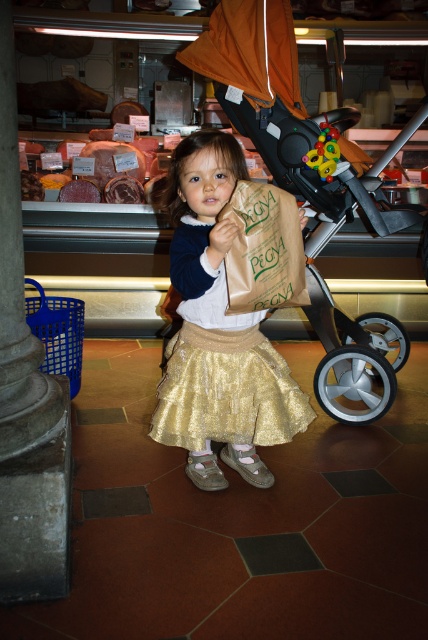
Based on the photo, who is lower down, gold shimmering skirt at center or brown paper bag at center?

Positioned lower is gold shimmering skirt at center.

Is gold shimmering skirt at center shorter than brown paper bag at center?

No.

Does point (175, 406) come closer to viewer compared to point (288, 262)?

No, it is behind (288, 262).

You are a GUI agent. You are given a task and a screenshot of the screen. Output one action in this format:
    pyautogui.click(x=<x>, y=<y>)
    Task: Click on the gold shimmering skirt at center
    This screenshot has width=428, height=640.
    Given the screenshot: What is the action you would take?
    tap(217, 332)

Who is more forward, (210, 401) or (175, 388)?

Point (175, 388) is in front.

Which of these two, gold shimmering skirt at center or gold sequined skirt at center, stands shorter?

Standing shorter between the two is gold sequined skirt at center.

Where is `gold shimmering skirt at center`? gold shimmering skirt at center is located at coordinates (217, 332).

Is matte black stroller at center bigger than brown paper bag at center?

Yes.

Which is more to the right, matte black stroller at center or brown paper bag at center?

Positioned to the right is matte black stroller at center.

The width and height of the screenshot is (428, 640). I want to click on matte black stroller at center, so click(x=308, y=186).

Where is `matte black stroller at center`? The width and height of the screenshot is (428, 640). matte black stroller at center is located at coordinates (308, 186).